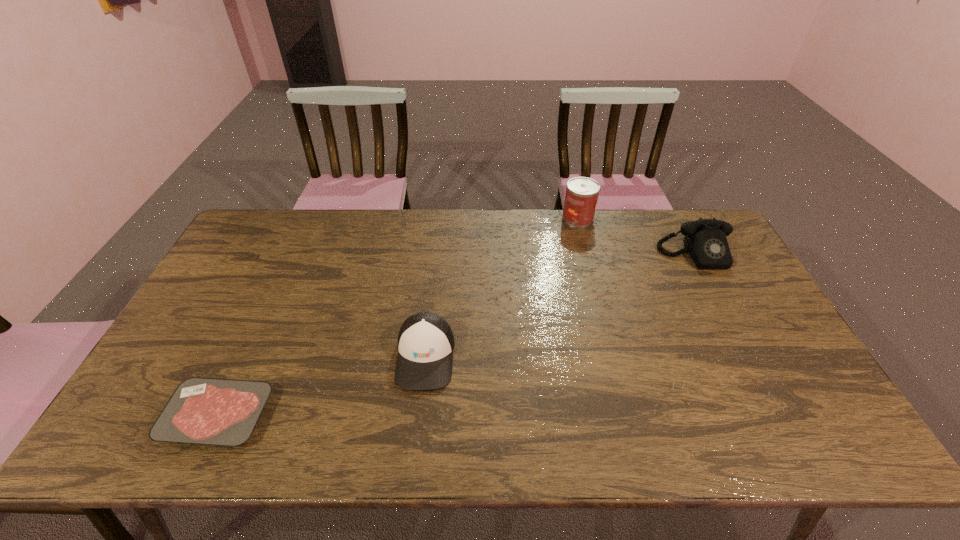
Find the location of a particular element. This screenshot has height=540, width=960. free space between the farthest object and the leftmost object is located at coordinates (397, 317).

Identify the location of vacant area that lies between the steak and the second object from left to right. Image resolution: width=960 pixels, height=540 pixels. (322, 386).

Locate which object is the closest to the tallest object. Please provide its 2D coordinates. Your answer should be formatted as a tuple, i.e. [(x, y)], where the tuple contains the x and y coordinates of a point satisfying the conditions above.

[(705, 240)]

Locate which object is the third closest to the tallest object. Please provide its 2D coordinates. Your answer should be formatted as a tuple, i.e. [(x, y)], where the tuple contains the x and y coordinates of a point satisfying the conditions above.

[(210, 411)]